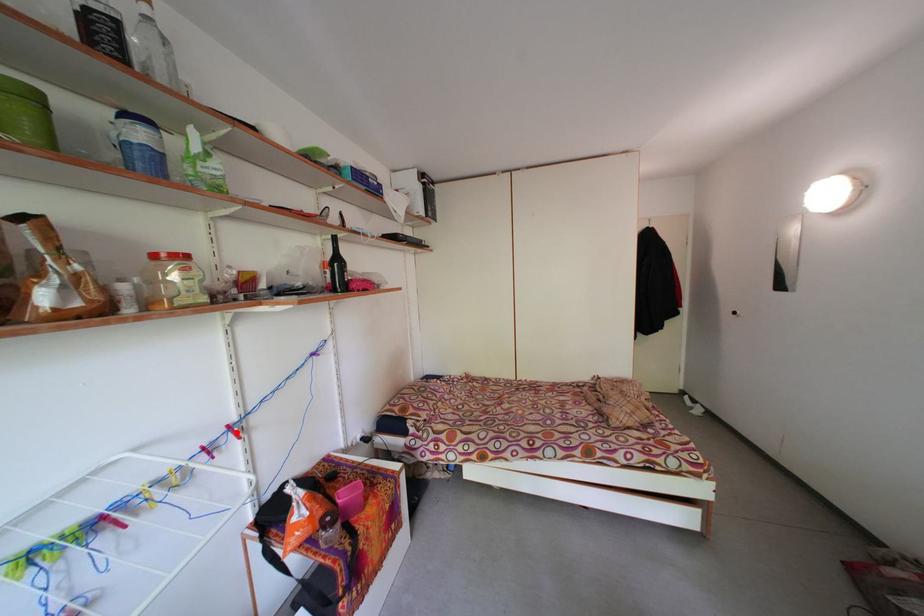
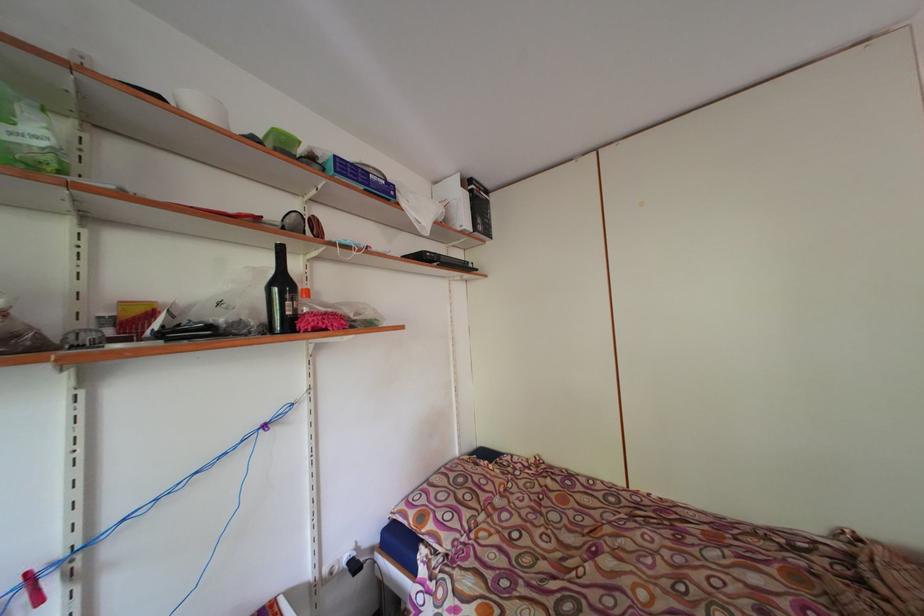
The point at the highlighted location is marked in the first image. Where is the corresponding point in the second image?

(35, 580)